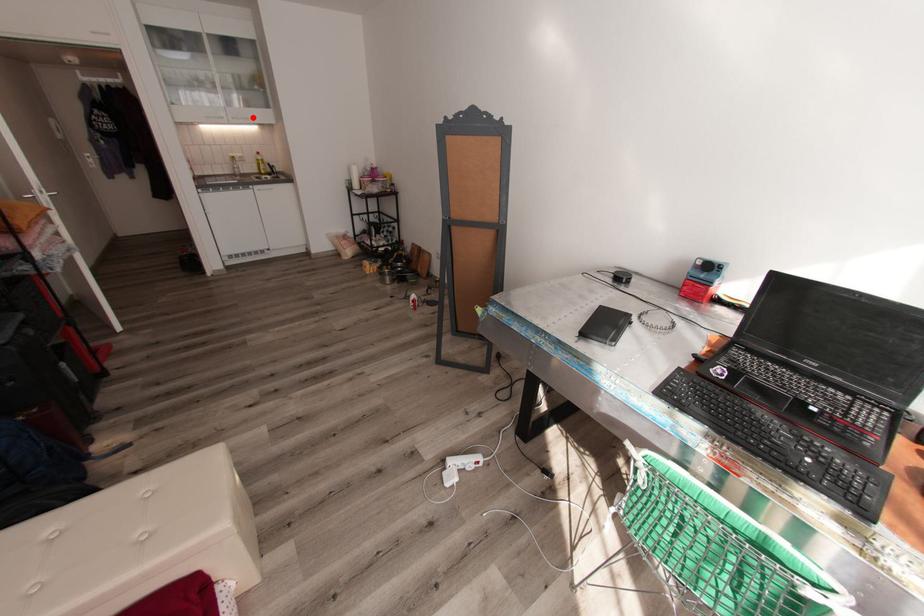
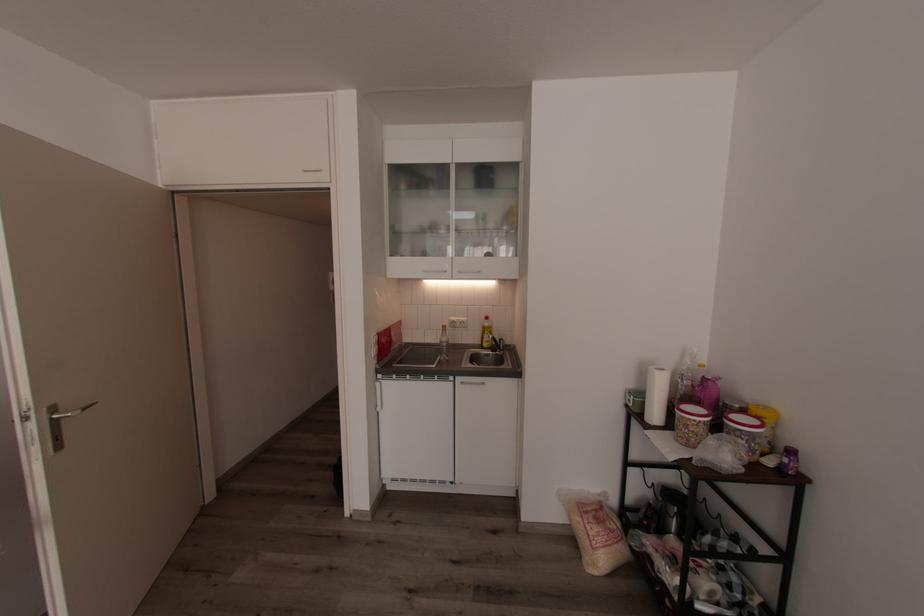
Locate, in the second image, the point that corresponds to the highlighted location in the first image.

(484, 272)